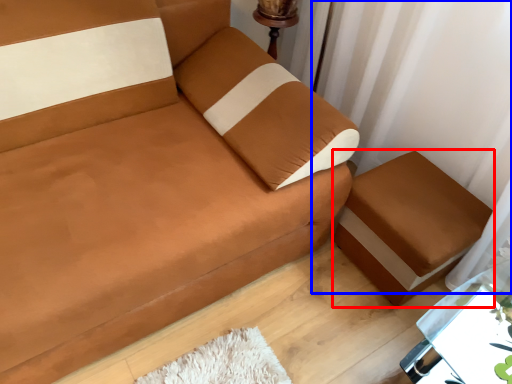
Question: Which object is closer to the camera taking this photo, furniture (highlighted by a red box) or curtain (highlighted by a blue box)?

Choices:
 (A) furniture
 (B) curtain

Answer: (B)